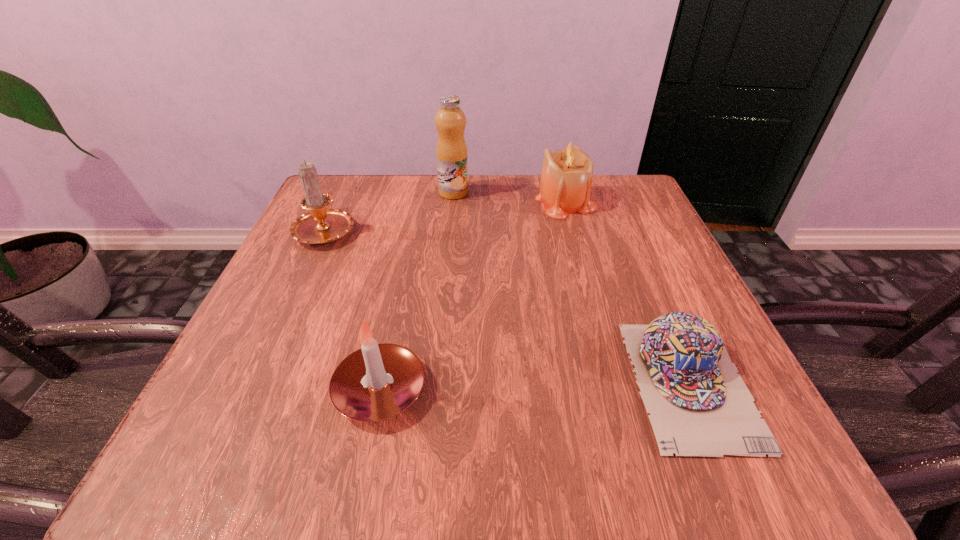
Where is `vacant region that satisfies the following two spatial constraints: 1. on the front side of the second candle from left to right; 2. on the left side of the leftmost candle`? vacant region that satisfies the following two spatial constraints: 1. on the front side of the second candle from left to right; 2. on the left side of the leftmost candle is located at coordinates (253, 390).